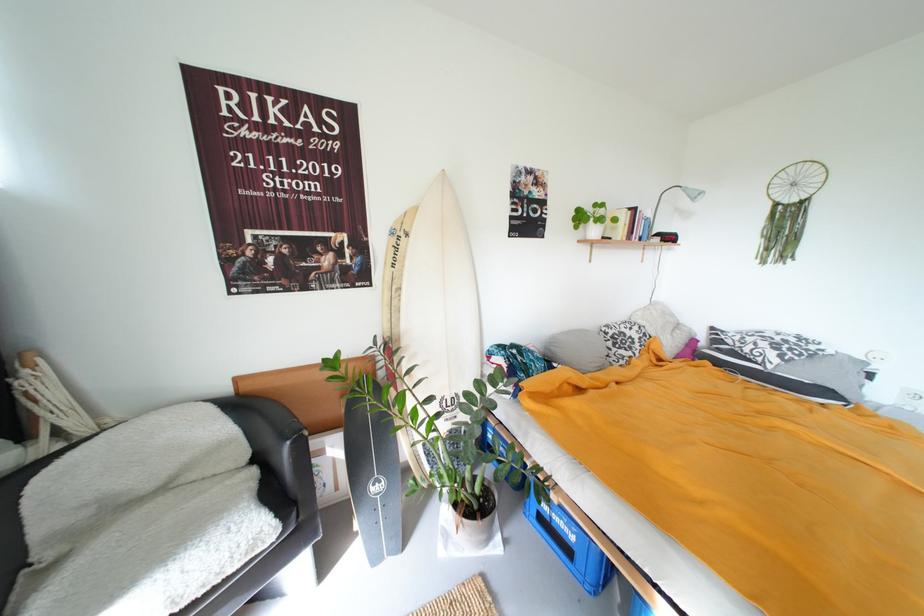
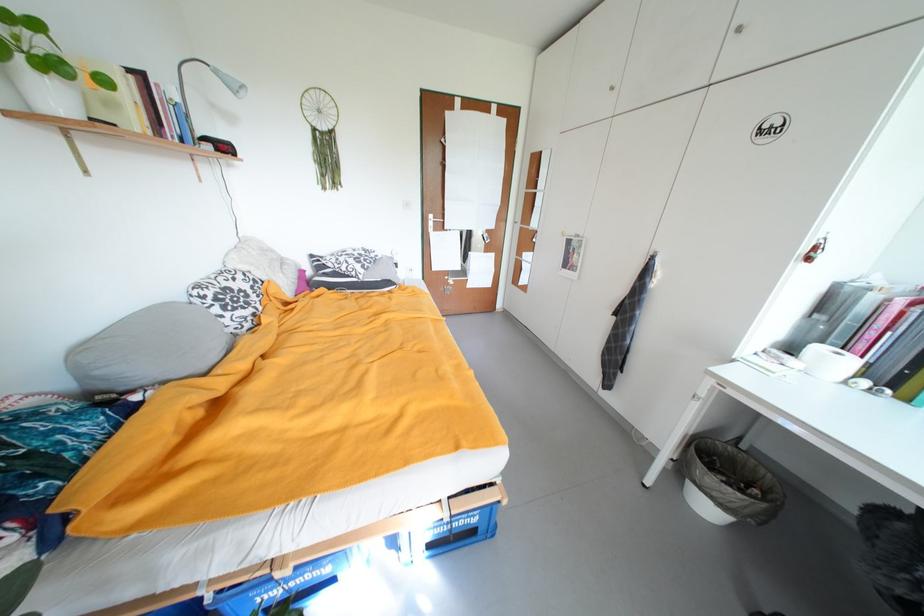
The point at (703, 198) is marked in the first image. Where is the corresponding point in the second image?

(244, 90)